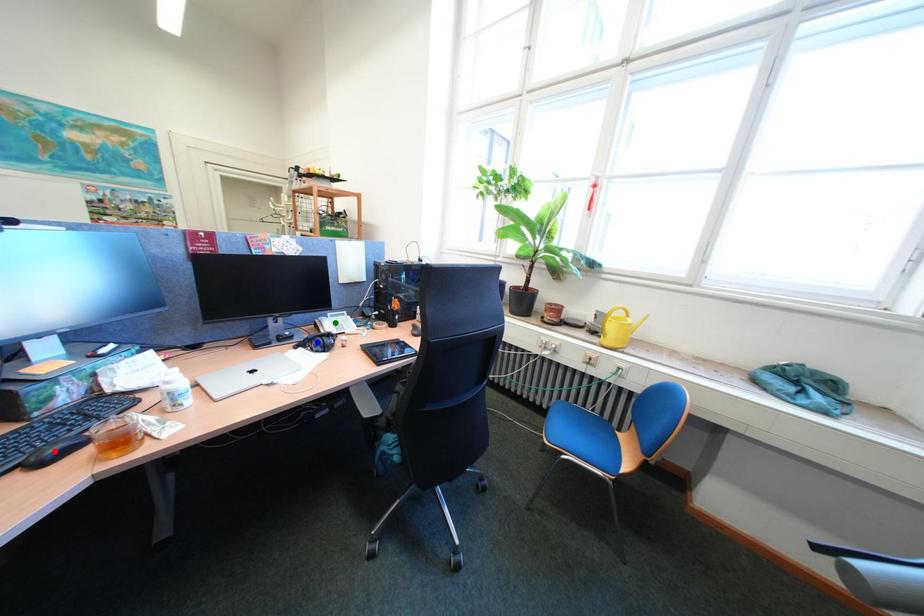
Order these from nearest to farthest:
red point, green point, blue point

red point, blue point, green point